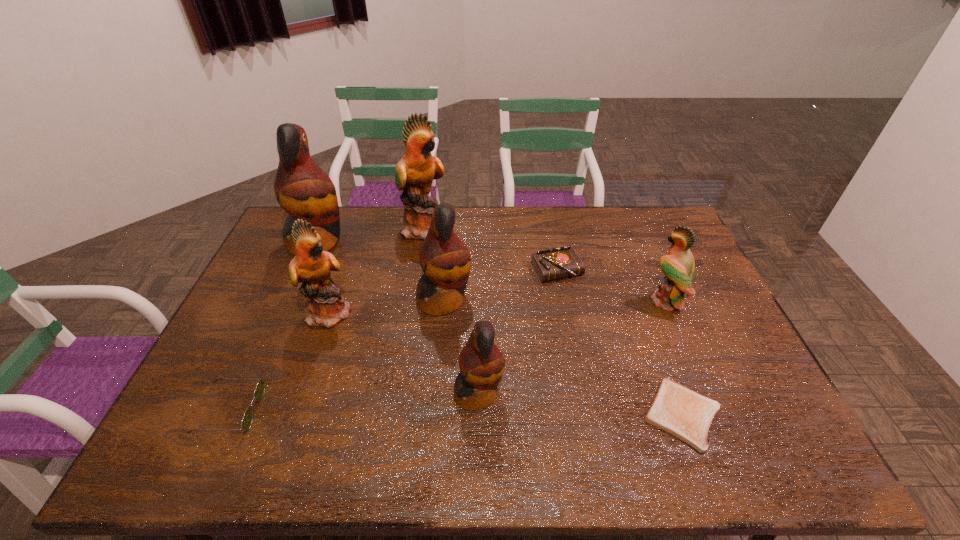
In order to click on green parrot that is the second closest one to the toast in this screenshot , I will do `click(415, 172)`.

Where is `red parrot that stands as the closest to the leftmost red parrot`? red parrot that stands as the closest to the leftmost red parrot is located at coordinates pos(445,260).

This screenshot has height=540, width=960. Find the location of `red parrot that is the closest to the sunglasses`. red parrot that is the closest to the sunglasses is located at coordinates (445, 260).

The height and width of the screenshot is (540, 960). What are the coordinates of `vacant area that satisfies the following two spatial constraints: 1. on the front side of the seventh object from left to right; 2. on the face of the nearest red parrot` in the screenshot? It's located at (581, 393).

Find the location of `free space that satisfies the following two spatial constraints: 1. on the face of the second farthest red parrot; 2. on the back side of the toast`. free space that satisfies the following two spatial constraints: 1. on the face of the second farthest red parrot; 2. on the back side of the toast is located at coordinates (435, 414).